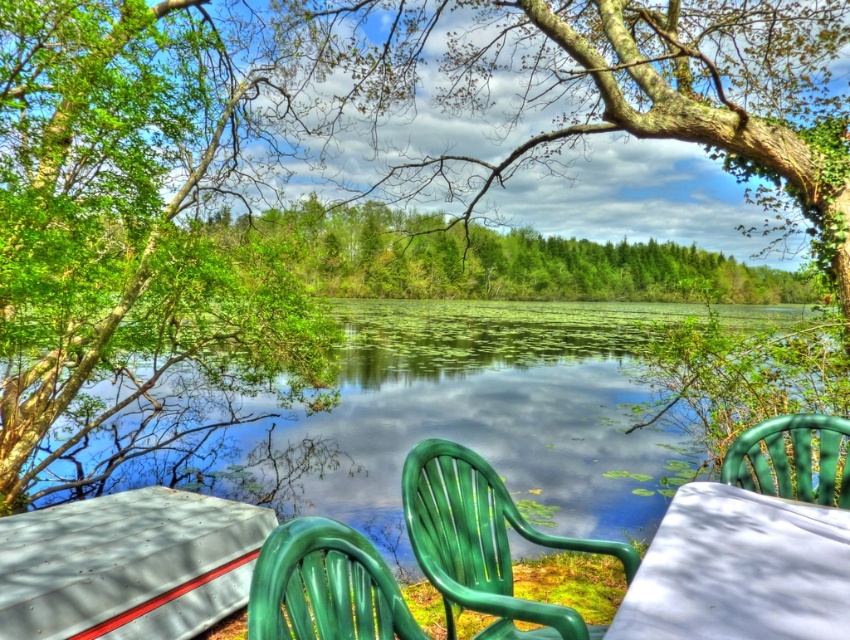
Can you confirm if white glossy table at lower right is thinner than green plastic chair at lower center?

Incorrect, white glossy table at lower right's width is not less than green plastic chair at lower center's.

Which is above, white glossy table at lower right or green plastic chair at lower center?

green plastic chair at lower center is higher up.

Between point (639, 620) and point (261, 637), which one is positioned in front?

Point (261, 637)

Locate an element on the screen. white glossy table at lower right is located at coordinates (740, 570).

Can you confirm if transparent water at center is wider than green leafy tree at center?

Yes, transparent water at center is wider than green leafy tree at center.

Is point (248, 406) farther from viewer compared to point (247, 234)?

Yes, point (248, 406) is farther from viewer.

Identify the location of transparent water at center. (462, 419).

Can you confirm if green leafy tree at center is positioned to the right of white matte table at lower left?

Yes, green leafy tree at center is to the right of white matte table at lower left.

What do you see at coordinates (491, 259) in the screenshot?
I see `green leafy tree at center` at bounding box center [491, 259].

At what (x,y) coordinates should I click in order to perform the action: click on green leafy tree at center. Please return your answer as a coordinate pair (x, y). The image size is (850, 640). Looking at the image, I should click on (491, 259).

In order to click on green leafy tree at center in this screenshot , I will do `click(491, 259)`.